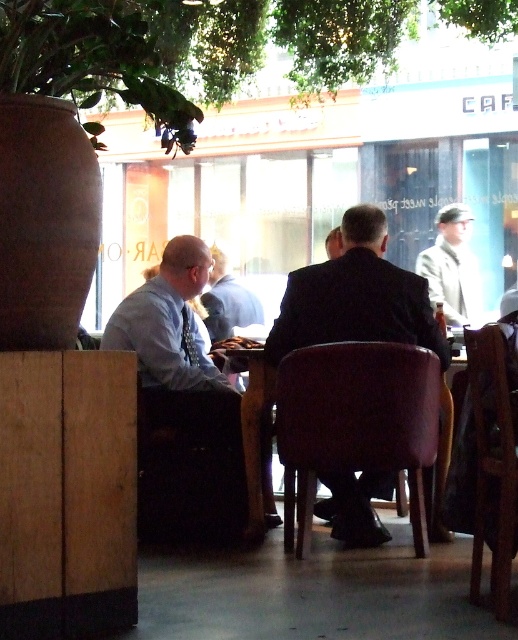
Is light blue shirt at center further to the viewer compared to smooth black suit at center?

Yes, it is behind smooth black suit at center.

Looking at this image, who is higher up, light blue shirt at center or smooth black suit at center?

smooth black suit at center

Does point (241, 284) come behind point (337, 230)?

Yes.

Find the location of a particular element. The height and width of the screenshot is (640, 518). light blue shirt at center is located at coordinates (227, 301).

Between point (501, 397) and point (338, 250), which one is positioned in front?

Point (501, 397) is in front.

Where is `brown leather chair at lower right`? This screenshot has height=640, width=518. brown leather chair at lower right is located at coordinates (493, 461).

Locate an element on the screen. This screenshot has height=640, width=518. brown leather chair at lower right is located at coordinates [493, 461].

Is light blue shirt at left bigger than light blue shirt at center?

Yes, light blue shirt at left is bigger than light blue shirt at center.

Is point (233, 467) behind point (222, 324)?

That is False.

Is point (190, 381) closer to camera compared to point (253, 305)?

Yes, point (190, 381) is in front of point (253, 305).

Identify the location of light blue shirt at left. coord(181,400).